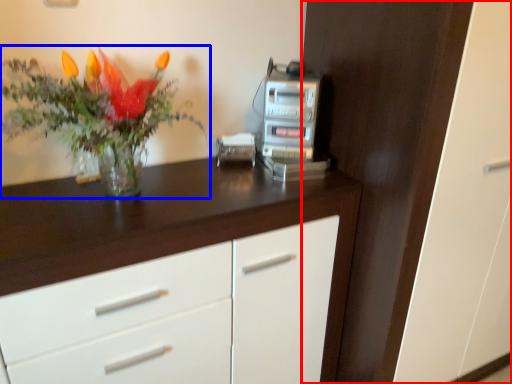
Question: Which of the following is the farthest to the observer, dresser (highlighted by a red box) or houseplant (highlighted by a blue box)?

Choices:
 (A) dresser
 (B) houseplant

Answer: (A)